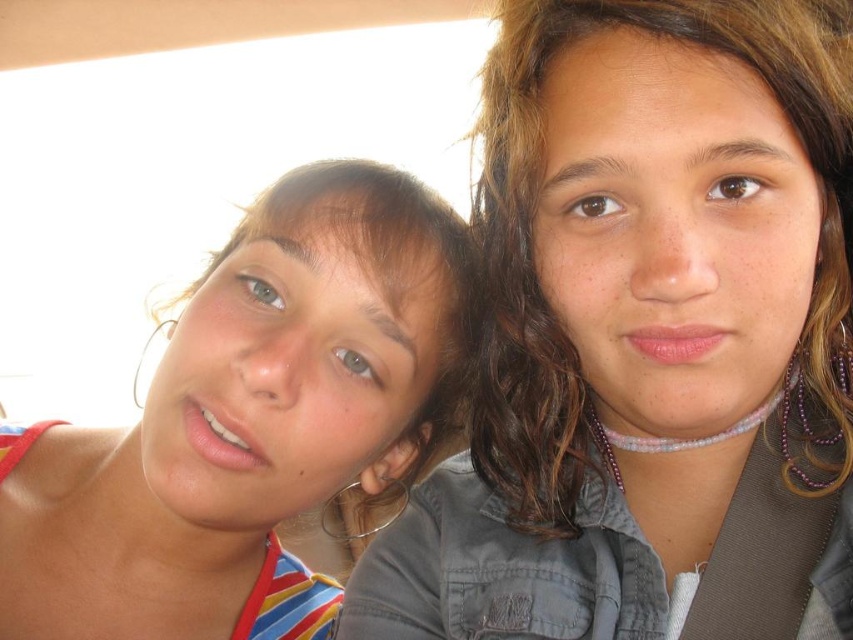
Consider the image. You are a photographer adjusting the camera settings for a portrait. You notice the matte gray shirt at upper right and the matte striped tank top at left in the frame. Which clothing item should you focus on to ensure the subject in the background is properly exposed, considering their height difference?

The matte gray shirt at upper right is much taller than the matte striped tank top at left, so focusing on the taller matte gray shirt at upper right would help ensure the background exposure aligns with the subject.

You are a photographer adjusting your camera settings to focus on the matte gray shirt at upper right. What are the coordinates you should input into your camera to ensure precise focus?

The coordinates for the matte gray shirt at upper right are at point (648, 339), so you should input those coordinates into your camera to focus precisely on it.